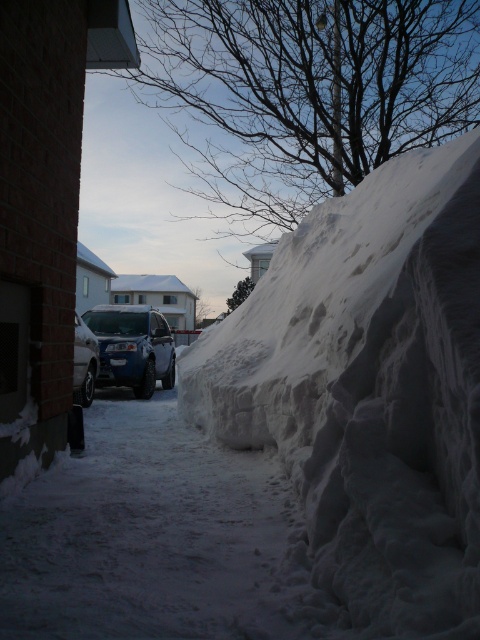
Looking at this image, does satin blue sedan at center have a lesser height compared to silver metallic car at center?

In fact, satin blue sedan at center may be taller than silver metallic car at center.

Who is shorter, satin blue sedan at center or silver metallic car at center?

Standing shorter between the two is silver metallic car at center.

Is point (137, 346) farther from camera compared to point (86, 362)?

Yes, it is behind point (86, 362).

Identify the location of satin blue sedan at center. This screenshot has height=640, width=480. (132, 348).

Describe the element at coordinates (369, 392) in the screenshot. I see `white fluffy snow at right` at that location.

Where is `white fluffy snow at right`? The image size is (480, 640). white fluffy snow at right is located at coordinates (369, 392).

Is point (312, 316) positioned after point (128, 378)?

No, (312, 316) is closer to viewer.

Is white fluffy snow at right above satin blue sedan at center?

No.

What are the coordinates of `white fluffy snow at right` in the screenshot? It's located at (369, 392).